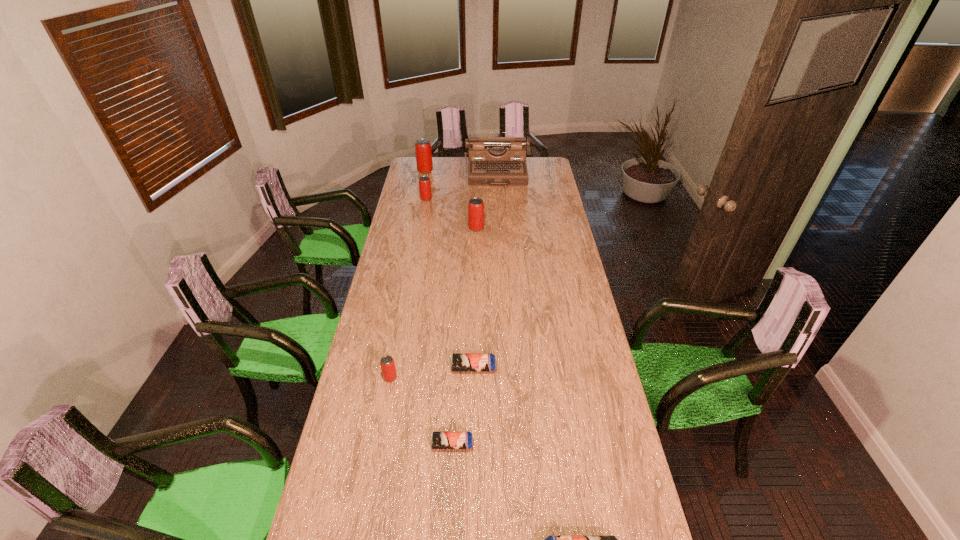
This screenshot has height=540, width=960. I want to click on typewriter, so pyautogui.click(x=493, y=161).

Where is `the farthest pink beer can`? The width and height of the screenshot is (960, 540). the farthest pink beer can is located at coordinates (423, 151).

This screenshot has width=960, height=540. I want to click on the tallest beer can, so click(x=423, y=151).

Where is `the third farthest pink beer can`? The image size is (960, 540). the third farthest pink beer can is located at coordinates (475, 205).

What are the coordinates of `the second tallest beer can` in the screenshot? It's located at (475, 205).

Identify the location of the sixth nearest object. (424, 182).

Where is `the sixth nearest beer can`? The image size is (960, 540). the sixth nearest beer can is located at coordinates (424, 182).

At what (x,y) coordinates should I click in order to perform the action: click on the smallest pink beer can. Please return your answer as a coordinate pair (x, y). Looking at the image, I should click on (387, 364).

Where is `the fifth tallest object`? This screenshot has width=960, height=540. the fifth tallest object is located at coordinates (387, 364).

This screenshot has width=960, height=540. Identify the location of the farthest blue beer can. (459, 362).